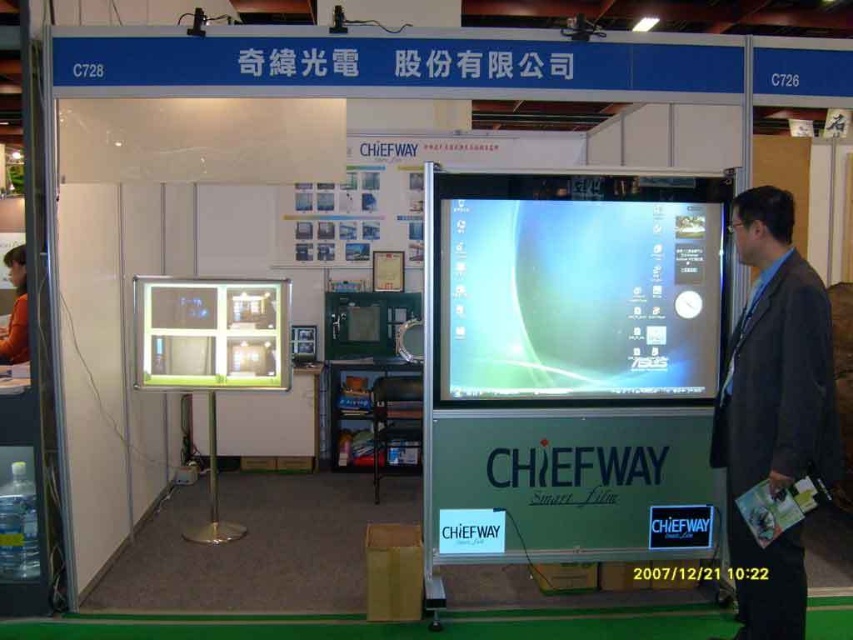
Who is lower down, dark gray suit at right or matte glass display at center?

dark gray suit at right is lower down.

What are the coordinates of `dark gray suit at right` in the screenshot? It's located at (775, 408).

Is point (785, 282) less distant than point (287, 381)?

Yes.

Locate an element on the screen. Image resolution: width=853 pixels, height=640 pixels. dark gray suit at right is located at coordinates (775, 408).

Does matte glass monitor at center have a greater width compared to matte glass display at center?

Yes.

Is point (581, 202) behind point (281, 300)?

No, (581, 202) is closer to viewer.

The width and height of the screenshot is (853, 640). Identify the location of matte glass monitor at center. (577, 288).

Where is `matte glass monitor at center`? The height and width of the screenshot is (640, 853). matte glass monitor at center is located at coordinates (577, 288).

Does matte glass monitor at center appear under dark gray suit at right?

No.

Image resolution: width=853 pixels, height=640 pixels. I want to click on matte glass monitor at center, so click(x=577, y=288).